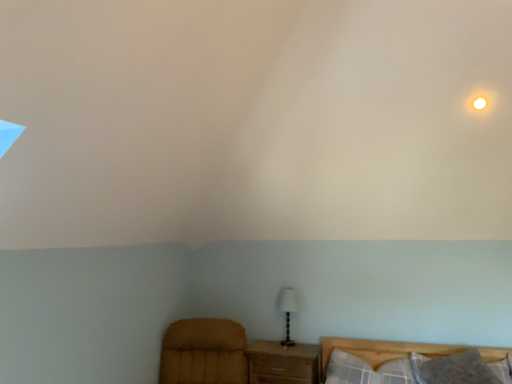
This screenshot has width=512, height=384. I want to click on white fabric lampshade at center, so click(x=287, y=311).

Where is `white glossy light at upper right`? white glossy light at upper right is located at coordinates (479, 101).

The width and height of the screenshot is (512, 384). I want to click on gray soft pillow at lower right, the first pillow when ordered from right to left, so click(453, 369).

What is the approximate height of plaid fabric pillow at lower right, the second pillow when ordered from right to left?

plaid fabric pillow at lower right, the second pillow when ordered from right to left, is 26.60 centimeters tall.

I want to click on white fabric lampshade at center, so click(287, 311).

How far apart are plaid fabric pillow at lower right, the second pillow when ordered from right to left, and white glossy light at upper right?

plaid fabric pillow at lower right, the second pillow when ordered from right to left, is 6.51 feet from white glossy light at upper right.

Identify the location of pillow lying on the left of white glossy light at upper right. (350, 370).

Who is smaller, plaid fabric pillow at lower right, the second pillow when ordered from right to left, or white glossy light at upper right?

Smaller between the two is white glossy light at upper right.

Does point (339, 363) come in front of point (485, 107)?

No, (339, 363) is behind (485, 107).

Based on the photo, does gray soft pillow at lower right, the 2th pillow when ordered from left to right, have a lesser height compared to wooden nightstand at lower center?

Yes, gray soft pillow at lower right, the 2th pillow when ordered from left to right, is shorter than wooden nightstand at lower center.

Is wooden nightstand at lower center at the back of gray soft pillow at lower right, the first pillow when ordered from right to left?

No.

Is wooden nightstand at lower center inside gray soft pillow at lower right, the first pillow when ordered from right to left?

That's incorrect, wooden nightstand at lower center is not inside gray soft pillow at lower right, the first pillow when ordered from right to left.

Which point is more forward, (418, 367) or (275, 380)?

The point (418, 367) is closer.

Can you confirm if plaid fabric pillow at lower right, the second pillow when ordered from right to left, is taller than velvet brown armchair at lower left?

No, plaid fabric pillow at lower right, the second pillow when ordered from right to left, is not taller than velvet brown armchair at lower left.

From the image's perspective, which one is positioned higher, plaid fabric pillow at lower right, the 1th pillow positioned from the left, or velvet brown armchair at lower left?

velvet brown armchair at lower left.

Find the location of a particular element. the 1st pillow to the right when counting from the velvet brown armchair at lower left is located at coordinates (350, 370).

Is plaid fabric pillow at lower right, the 1th pillow positioned from the left, oriented away from velvet brown armchair at lower left?

plaid fabric pillow at lower right, the 1th pillow positioned from the left, is not turned away from velvet brown armchair at lower left.

Do you think white glossy light at upper right is within wooden nightstand at lower center, or outside of it?

white glossy light at upper right is outside wooden nightstand at lower center.

Which is more to the right, white glossy light at upper right or wooden nightstand at lower center?

Positioned to the right is white glossy light at upper right.

Is wooden nightstand at lower center at the back of white glossy light at upper right?

That's not correct — white glossy light at upper right is not looking away from wooden nightstand at lower center.

Can you confirm if wooden nightstand at lower center is thinner than white fabric lampshade at center?

No, wooden nightstand at lower center is not thinner than white fabric lampshade at center.

Is wooden nightstand at lower center at the left side of white fabric lampshade at center?

A: Correct, you'll find wooden nightstand at lower center to the left of white fabric lampshade at center.

Is wooden nightstand at lower center not within white fabric lampshade at center?

Yes.

Is wooden nightstand at lower center taller than white fabric lampshade at center?

In fact, wooden nightstand at lower center may be shorter than white fabric lampshade at center.

In terms of height, does gray soft pillow at lower right, the first pillow when ordered from right to left, look taller or shorter compared to plaid fabric pillow at lower right, the 1th pillow positioned from the left?

gray soft pillow at lower right, the first pillow when ordered from right to left, is shorter than plaid fabric pillow at lower right, the 1th pillow positioned from the left.

Between gray soft pillow at lower right, the first pillow when ordered from right to left, and plaid fabric pillow at lower right, the 1th pillow positioned from the left, which one has smaller width?

With smaller width is gray soft pillow at lower right, the first pillow when ordered from right to left.

Considering the relative sizes of gray soft pillow at lower right, the first pillow when ordered from right to left, and plaid fabric pillow at lower right, the 1th pillow positioned from the left, in the image provided, is gray soft pillow at lower right, the first pillow when ordered from right to left, bigger than plaid fabric pillow at lower right, the 1th pillow positioned from the left,?

No.

What's the angular difference between gray soft pillow at lower right, the 2th pillow when ordered from left to right, and plaid fabric pillow at lower right, the second pillow when ordered from right to left,'s facing directions?

The angle between the facing direction of gray soft pillow at lower right, the 2th pillow when ordered from left to right, and the facing direction of plaid fabric pillow at lower right, the second pillow when ordered from right to left, is 0.000287 degrees.

From a real-world perspective, is velvet brown armchair at lower left below gray soft pillow at lower right, the 2th pillow when ordered from left to right?

No, from a real-world perspective, velvet brown armchair at lower left is not under gray soft pillow at lower right, the 2th pillow when ordered from left to right.

Is velvet brown armchair at lower left inside the boundaries of gray soft pillow at lower right, the 2th pillow when ordered from left to right, or outside?

velvet brown armchair at lower left is not enclosed by gray soft pillow at lower right, the 2th pillow when ordered from left to right.

Does velvet brown armchair at lower left appear on the left side of gray soft pillow at lower right, the 2th pillow when ordered from left to right?

Yes.

You are a GUI agent. You are given a task and a screenshot of the screen. Output one action in this format:
    pyautogui.click(x=<x>, y=<y>)
    Task: Click on the pillow on the left of the white glossy light at upper right
    Image resolution: width=512 pixels, height=384 pixels.
    Given the screenshot: What is the action you would take?
    pyautogui.click(x=350, y=370)

Find the location of a particular element. nightstand behind the gray soft pillow at lower right, the 2th pillow when ordered from left to right is located at coordinates (283, 363).

Looking at the image, which one is located further to white glossy light at upper right, wooden nightstand at lower center or velvet brown armchair at lower left?

Among the two, velvet brown armchair at lower left is located further to white glossy light at upper right.

Which object lies further to the anchor point plaid fabric pillow at lower right, the 1th pillow positioned from the left, white glossy light at upper right or velvet brown armchair at lower left?

white glossy light at upper right lies further to plaid fabric pillow at lower right, the 1th pillow positioned from the left, than the other object.

From the image, which object appears to be nearer to plaid fabric pillow at lower right, the 1th pillow positioned from the left, gray soft pillow at lower right, the 2th pillow when ordered from left to right, or white fabric lampshade at center?

gray soft pillow at lower right, the 2th pillow when ordered from left to right, is closer to plaid fabric pillow at lower right, the 1th pillow positioned from the left.

Based on their spatial positions, is plaid fabric pillow at lower right, the second pillow when ordered from right to left, or wooden nightstand at lower center closer to white fabric lampshade at center?

wooden nightstand at lower center is closer to white fabric lampshade at center.

Based on their spatial positions, is white fabric lampshade at center or velvet brown armchair at lower left further from white glossy light at upper right?

The object further to white glossy light at upper right is velvet brown armchair at lower left.

From the image, which object appears to be farther from white fabric lampshade at center, velvet brown armchair at lower left or wooden nightstand at lower center?

velvet brown armchair at lower left.

From the image, which object appears to be farther from velvet brown armchair at lower left, plaid fabric pillow at lower right, the 1th pillow positioned from the left, or gray soft pillow at lower right, the first pillow when ordered from right to left?

Among the two, gray soft pillow at lower right, the first pillow when ordered from right to left, is located further to velvet brown armchair at lower left.

When comparing their distances from plaid fabric pillow at lower right, the 1th pillow positioned from the left, does velvet brown armchair at lower left or gray soft pillow at lower right, the 2th pillow when ordered from left to right, seem further?

velvet brown armchair at lower left is further to plaid fabric pillow at lower right, the 1th pillow positioned from the left.

You are a GUI agent. You are given a task and a screenshot of the screen. Output one action in this format:
    pyautogui.click(x=<x>, y=<y>)
    Task: Click on the table lamp between velvet brown armchair at lower left and plaid fabric pillow at lower right, the 1th pillow positioned from the left, from left to right
    Image resolution: width=512 pixels, height=384 pixels.
    Given the screenshot: What is the action you would take?
    [x=287, y=311]

Identify the location of pillow between wooden nightstand at lower center and gray soft pillow at lower right, the first pillow when ordered from right to left, from left to right. Image resolution: width=512 pixels, height=384 pixels. (350, 370).

At what (x,y) coordinates should I click in order to perform the action: click on table lamp situated between wooden nightstand at lower center and gray soft pillow at lower right, the 2th pillow when ordered from left to right, from left to right. Please return your answer as a coordinate pair (x, y). Looking at the image, I should click on (287, 311).

You are a GUI agent. You are given a task and a screenshot of the screen. Output one action in this format:
    pyautogui.click(x=<x>, y=<y>)
    Task: Click on the nightstand between velvet brown armchair at lower left and gray soft pillow at lower right, the first pillow when ordered from right to left
    
    Given the screenshot: What is the action you would take?
    pyautogui.click(x=283, y=363)